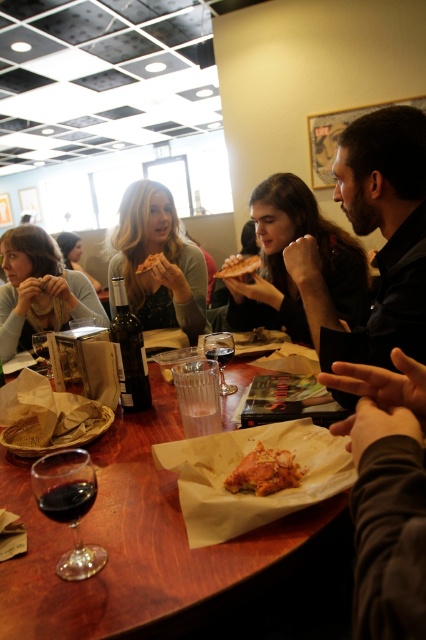
You are a waiter trying to place a new plate of food on the table. The table has the dark brown leather jacket at center and the golden crispy pizza slice at center. Which item should you move to make space?

You should move the dark brown leather jacket at center because it might be wider than the golden crispy pizza slice at center, so moving it would create more space for the new plate.

You are a photographer trying to capture a closeup of the point at coordinates (249, 484) in the scene. Given that your camera requires the subject to be at least 30 inches away to focus properly, will you be able to take a clear photo of that point?

The point at coordinates (249, 484) is only 29.39 inches away from the camera, which is slightly less than the required 30 inches. Therefore, the camera may not focus properly, resulting in a blurry photo.

You are a waiter holding a tray of drinks. You need to navigate from the kitchen entrance to the table where the dark gray fabric hand at lower right and the matte black pizza at upper left are located. Can you safely walk between them without spilling the drinks?

The distance between the dark gray fabric hand at lower right and the matte black pizza at upper left is 1.28 meters. Since this space is sufficient for a person to walk through comfortably, you can safely navigate between them without spilling the drinks.